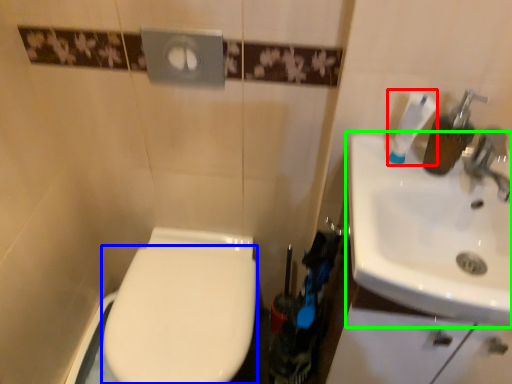
Question: Which is farther away from toothpaste (highlighted by a red box)? bidet (highlighted by a blue box) or sink (highlighted by a green box)?

Choices:
 (A) bidet
 (B) sink

Answer: (A)